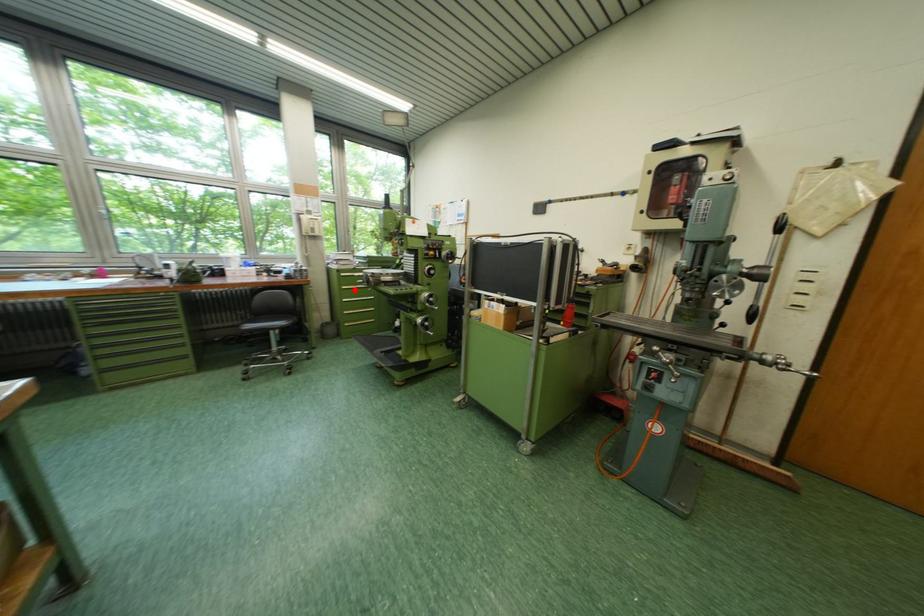
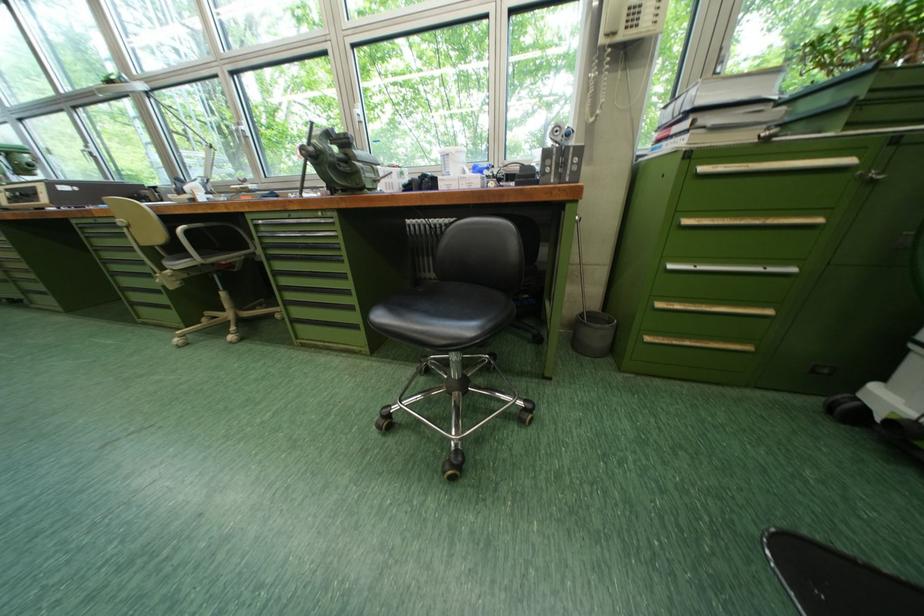
Question: I am providing you with two images of the same scene from different viewpoints. A red point is marked on the first image. Is the red point's position out of view in image 2?

Choices:
 (A) Yes
 (B) No

Answer: (B)